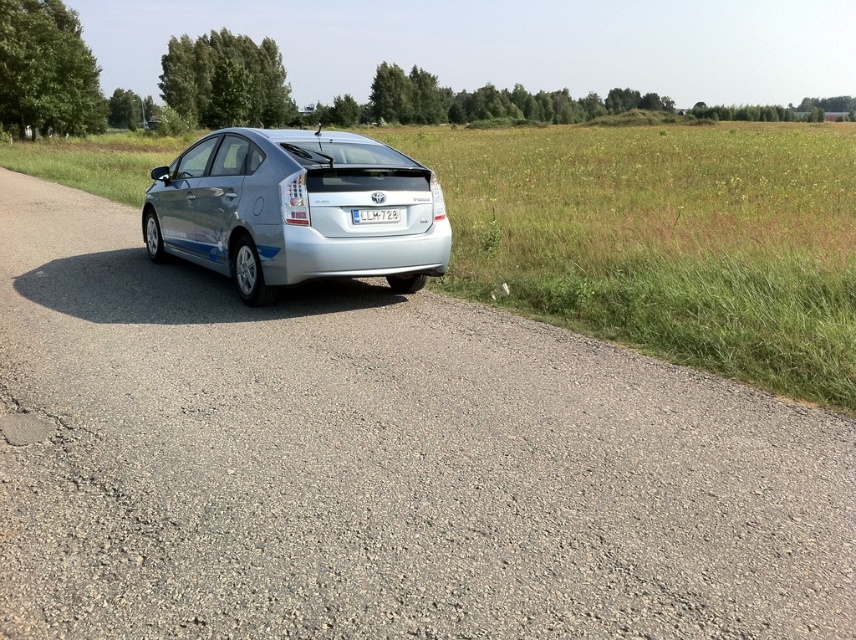
Question: Which point appears farthest from the camera in this image?

Choices:
 (A) (389, 216)
 (B) (189, 188)

Answer: (B)

Question: Which point is closer to the camera?

Choices:
 (A) white plastic license plate at center
 (B) silver metallic car at center

Answer: (B)

Question: Does silver metallic car at center appear on the left side of white plastic license plate at center?

Choices:
 (A) yes
 (B) no

Answer: (A)

Question: Where is silver metallic car at center located in relation to white plastic license plate at center in the image?

Choices:
 (A) left
 (B) right

Answer: (A)

Question: Is silver metallic car at center wider than white plastic license plate at center?

Choices:
 (A) no
 (B) yes

Answer: (B)